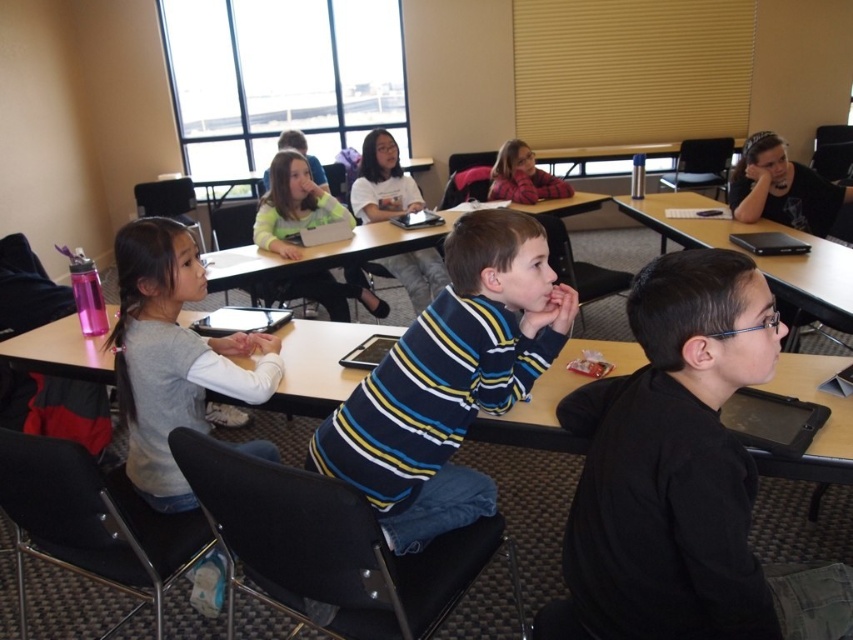
Who is positioned more to the left, matte plastic table at center or matte green sweater at center?

matte green sweater at center is more to the left.

Is matte plastic table at center shorter than matte green sweater at center?

Yes, matte plastic table at center is shorter than matte green sweater at center.

Which is in front, point (830, 477) or point (286, 154)?

Point (830, 477) is in front.

Where is `matte plastic table at center`? The image size is (853, 640). matte plastic table at center is located at coordinates (318, 364).

Which of these two, matte green sweater at center or white cotton shirt at center, stands taller?

With more height is white cotton shirt at center.

Is matte green sweater at center further to camera compared to white cotton shirt at center?

That is False.

At what (x,y) coordinates should I click in order to perform the action: click on matte green sweater at center. Please return your answer as a coordinate pair (x, y). Image resolution: width=853 pixels, height=640 pixels. Looking at the image, I should click on (293, 205).

Who is positioned more to the right, gray cotton shirt at left or plaid fabric shirt at upper center?

Positioned to the right is plaid fabric shirt at upper center.

Between point (169, 397) and point (523, 148), which one is positioned behind?

The point (523, 148) is more distant.

The width and height of the screenshot is (853, 640). What are the coordinates of `gray cotton shirt at left` in the screenshot? It's located at (172, 356).